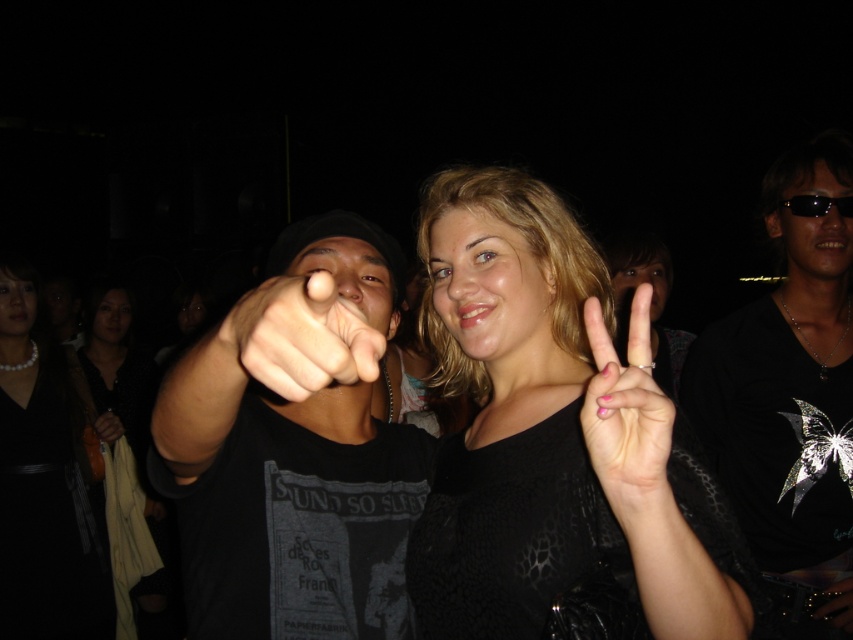
Can you confirm if black textured sweater at center is positioned to the left of dark skin hand at center?

Incorrect, black textured sweater at center is not on the left side of dark skin hand at center.

Based on the photo, does black textured sweater at center appear under dark skin hand at center?

No.

Is point (461, 358) in front of point (109, 436)?

Yes, it is in front of point (109, 436).

Where is `black textured sweater at center`? This screenshot has height=640, width=853. black textured sweater at center is located at coordinates (552, 432).

In the scene shown: Can you confirm if black matte t-shirt at center is shorter than blonde hair at center?

No, black matte t-shirt at center is not shorter than blonde hair at center.

Consider the image. Is black matte t-shirt at center closer to the viewer compared to blonde hair at center?

Yes, black matte t-shirt at center is in front of blonde hair at center.

Is point (320, 224) farther from camera compared to point (430, 337)?

No.

Locate an element on the screen. black matte t-shirt at center is located at coordinates (293, 456).

Does pearl necklace at center appear over matte black finger at center?

Incorrect, pearl necklace at center is not positioned above matte black finger at center.

Can you confirm if pearl necklace at center is positioned to the left of matte black finger at center?

Yes, pearl necklace at center is to the left of matte black finger at center.

Locate an element on the screen. The image size is (853, 640). pearl necklace at center is located at coordinates pos(44,484).